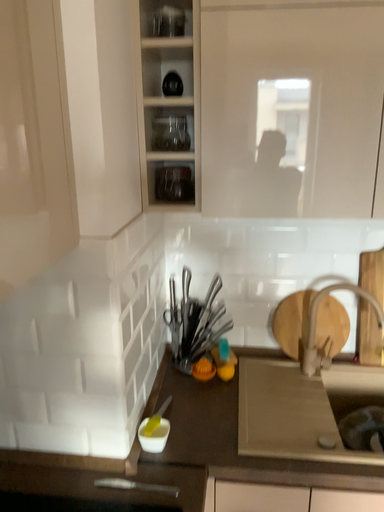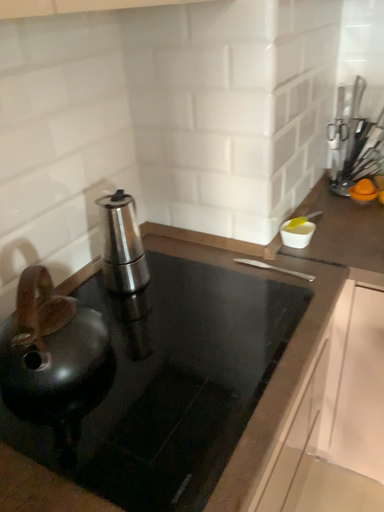
Question: Which way did the camera rotate in the video?

Choices:
 (A) rotated left
 (B) rotated right

Answer: (A)